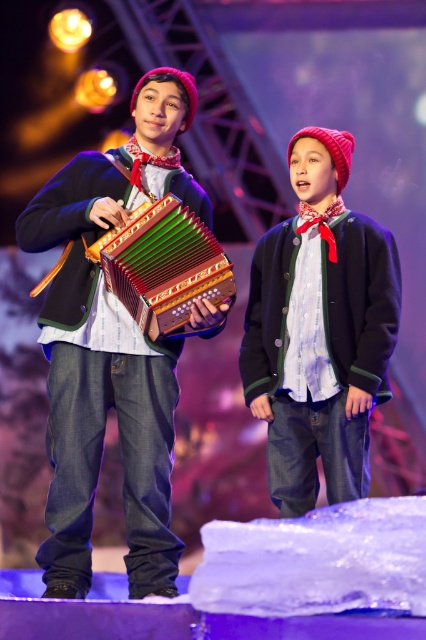
You are standing on stage and need to move from the point marked by coordinates point (74, 209) to the point marked by coordinates point (362, 248). Which direction should you face to walk directly towards your destination?

You should face upward because point (74, 209) is in front of point (362, 248), which means the destination is above your current position.

Based on the scene description, where is the matte black accordion at center located in the image?

The matte black accordion at center is located at point (111, 348).